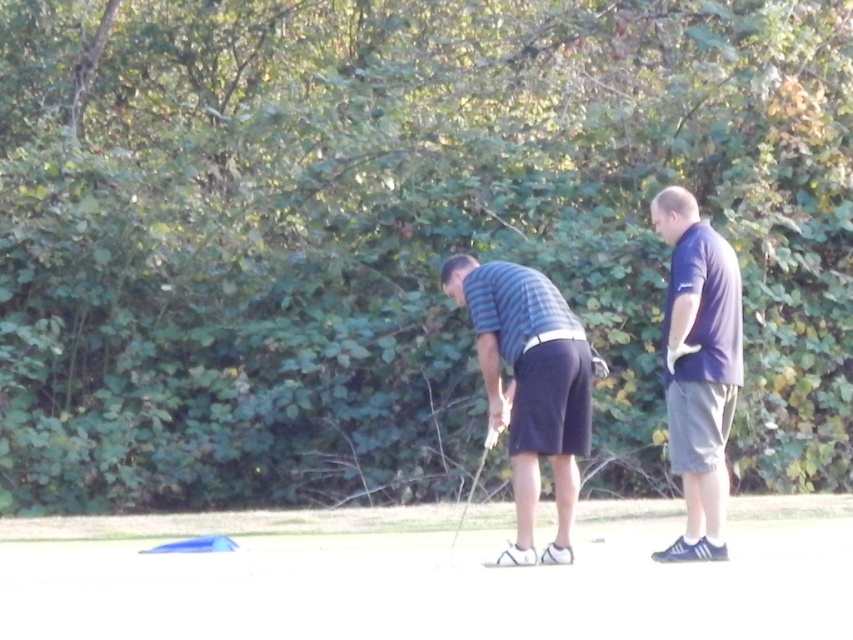
Looking at this image, you are a golfer who wants to place your metallic silver golf club at center on the white smooth sand at lower center. Can the golf club be placed on the sand without tilting?

The white smooth sand at lower center has a lesser height compared to metallic silver golf club at center. Therefore, the golf club might tilt because the sand is lower than the club.

You are a photographer positioned behind the two people on the golf course. You want to capture a photo where both the striped cotton shirt at center and the metallic silver golf club at center are clearly visible. Based on their heights, which object should be placed closer to the camera to ensure both are fully visible in the frame?

The striped cotton shirt at center is taller than the metallic silver golf club at center. To ensure both are fully visible, the metallic silver golf club at center should be placed closer to the camera since it is shorter, allowing the taller striped cotton shirt at center to still be in frame without being blocked.

You are standing at the point labeled as point (529, 387) in the image. What object is located exactly at that coordinate?

The point (529, 387) corresponds to the striped cotton shirt at center.